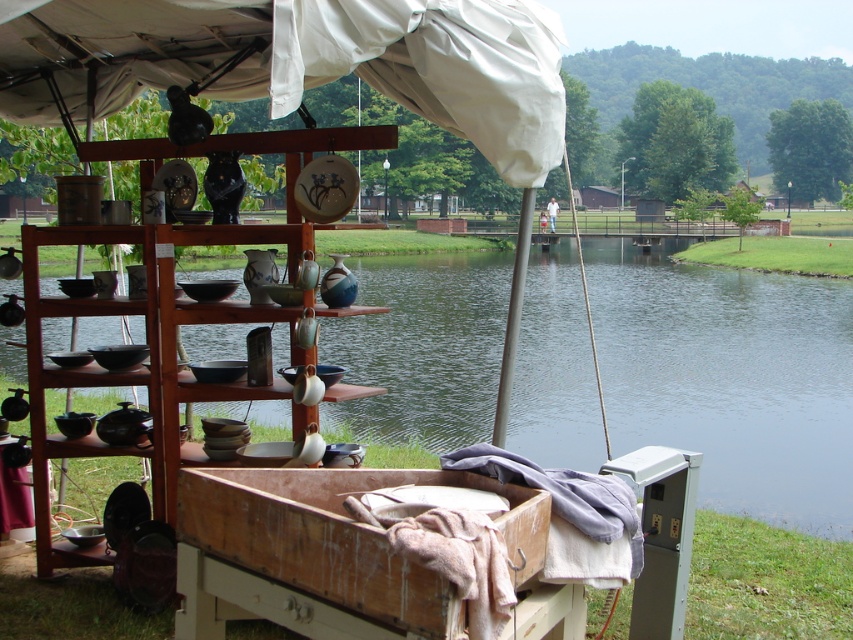
Does smooth water at center have a smaller size compared to wooden crate at lower center?

No, smooth water at center is not smaller than wooden crate at lower center.

Describe the element at coordinates (730, 378) in the screenshot. I see `smooth water at center` at that location.

Where is `smooth water at center`? smooth water at center is located at coordinates (730, 378).

From the picture: Can you confirm if smooth water at center is positioned below wooden shelves at center?

Actually, smooth water at center is above wooden shelves at center.

How distant is smooth water at center from wooden shelves at center?

They are 57.99 feet apart.

The width and height of the screenshot is (853, 640). Find the location of `smooth water at center`. smooth water at center is located at coordinates coord(730,378).

The image size is (853, 640). What are the coordinates of `smooth water at center` in the screenshot? It's located at (730, 378).

Is wooden crate at lower center closer to camera compared to wooden shelves at center?

That is True.

Is point (529, 509) in front of point (48, 237)?

Yes, it is in front of point (48, 237).

Where is `wooden crate at lower center`? Image resolution: width=853 pixels, height=640 pixels. wooden crate at lower center is located at coordinates (341, 557).